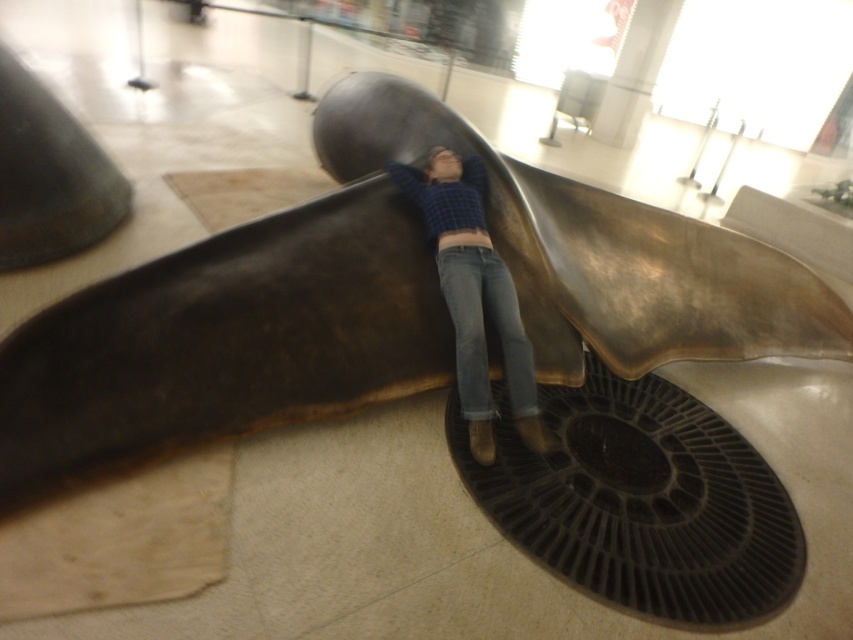
Question: Which point is closer to the camera?

Choices:
 (A) shiny bronze sculpture at center
 (B) denim jeans at center
 (C) blue plaid shirt at center

Answer: (C)

Question: Which point appears closest to the camera in this image?

Choices:
 (A) (467, 339)
 (B) (651, 344)

Answer: (A)

Question: Which object appears farthest from the camera in this image?

Choices:
 (A) shiny bronze sculpture at center
 (B) denim jeans at center
 (C) blue plaid shirt at center

Answer: (A)

Question: Does shiny bronze sculpture at center lie behind blue plaid shirt at center?

Choices:
 (A) no
 (B) yes

Answer: (B)

Question: Does shiny bronze sculpture at center appear on the right side of blue plaid shirt at center?

Choices:
 (A) no
 (B) yes

Answer: (B)

Question: Is shiny bronze sculpture at center thinner than denim jeans at center?

Choices:
 (A) yes
 (B) no

Answer: (B)